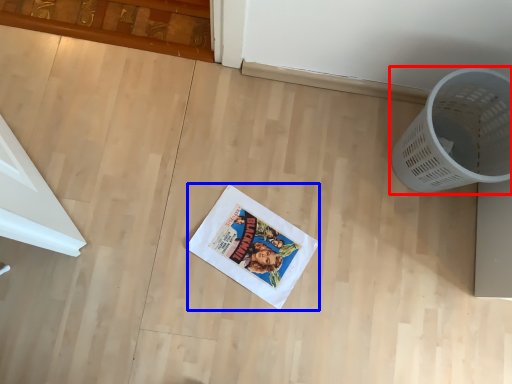
Question: Which object appears farthest to the camera in this image, waste container (highlighted by a red box) or comic book (highlighted by a blue box)?

Choices:
 (A) waste container
 (B) comic book

Answer: (B)